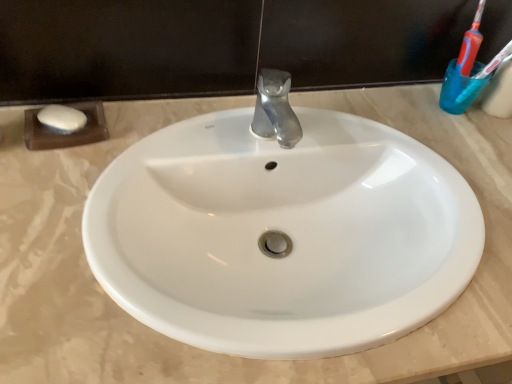
Where is `vacant space situated above white glossy sink at center (from a real-world perspective)`? vacant space situated above white glossy sink at center (from a real-world perspective) is located at coordinates (310, 153).